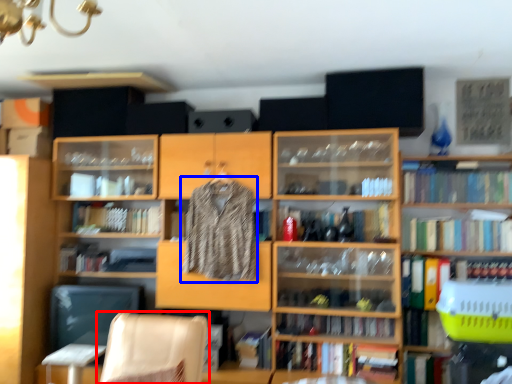
Question: Among these objects, which one is farthest to the camera, chair (highlighted by a red box) or clothing (highlighted by a blue box)?

Choices:
 (A) chair
 (B) clothing

Answer: (B)